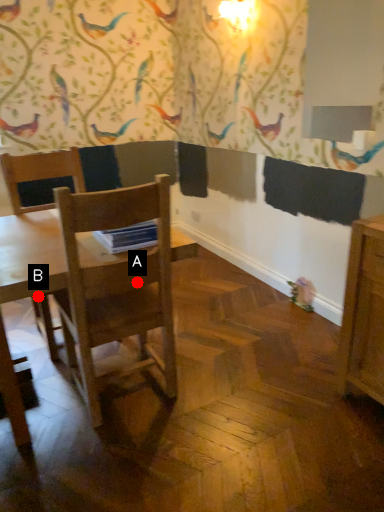
Question: Two points are circled on the image, labeled by A and B beside each circle. Which point is farther to the camera?

Choices:
 (A) A is further
 (B) B is further

Answer: (B)